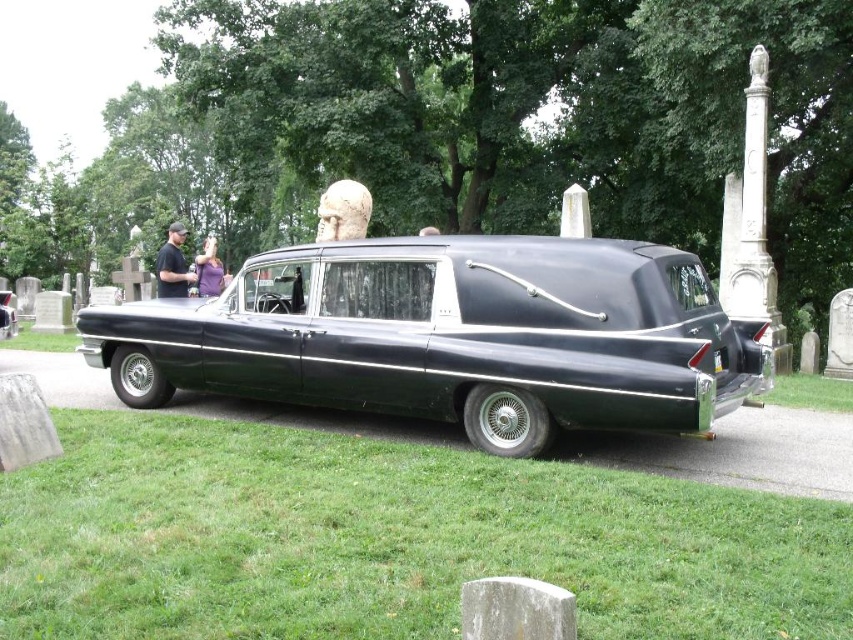
From the picture: You are standing at the point closer to the hearse in the cemetery scene. Which coordinate point are you at, point (x=463, y=344) or point (x=199, y=260)?

Point (x=199, y=260) is behind point (x=463, y=344), so if you are standing at the point closer to the hearse, you are at point (x=463, y=344).

You are standing in a cemetery and want to take a photo of the glossy black hearse at center. If your camera has a maximum focus range of 15 feet, will you need to move closer to capture a clear image?

The glossy black hearse at center is 17.61 feet away from the viewer. Since the camera can only focus up to 15 feet, you need to move closer to ensure the hearse is within the focus range.

You are standing at the point marked as point (451, 337) in the cemetery scene. What object is located exactly at this point?

The glossy black hearse at center is located exactly at point (451, 337).